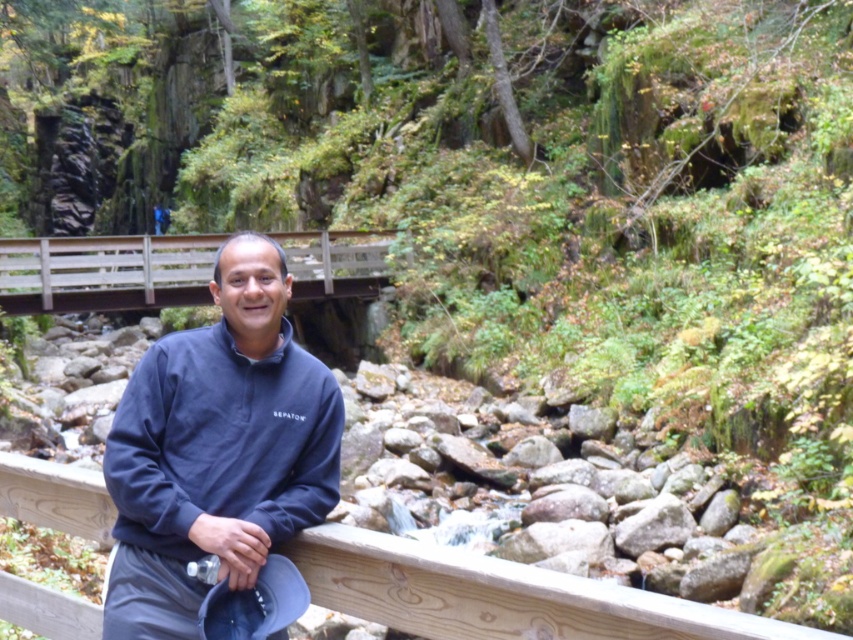
You are a photographer planning to capture the man in the navy fleece sweater at center and the wooden bridge at center in a single shot. Given that your camera has a fixed focal length, which object should you position closer to the camera to ensure both are in focus?

Since the navy fleece sweater at center is smaller than the wooden bridge at center, positioning the wooden bridge at center closer to the camera would help ensure both objects are in focus as the smaller object requires less depth of field adjustment.

Where is the navy fleece sweater at center located in the image?

The navy fleece sweater at center is located at point (218,449) in the image.

You are a hiker who wants to cross the wooden bridge at center. The wooden rail at center is there. Do you think the rail is big enough to hold you?

The wooden rail at center is smaller than wooden bridge at center, so it may not be as sturdy. It might not be able to hold your weight safely.